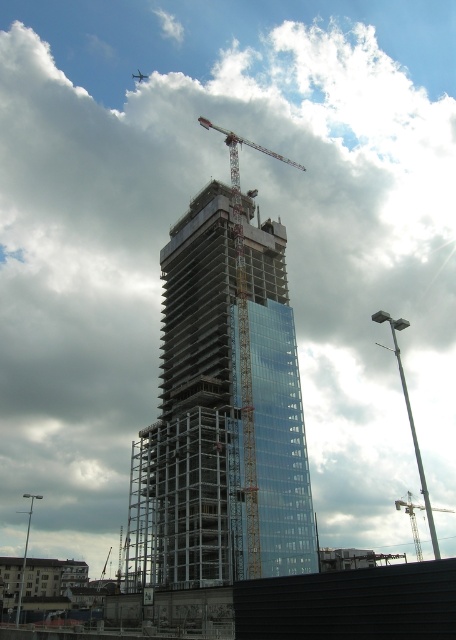
Question: Among these objects, which one is nearest to the camera?

Choices:
 (A) metallic construction crane at center
 (B) transparent glass tower at center

Answer: (B)

Question: Observing the image, what is the correct spatial positioning of transparent glass tower at center in reference to metallic silver crane at center?

Choices:
 (A) right
 (B) left

Answer: (B)

Question: Which object is farther from the camera taking this photo?

Choices:
 (A) metallic construction crane at center
 (B) metallic silver crane at center
 (C) transparent glass tower at center

Answer: (B)

Question: Is metallic construction crane at center positioned in front of metallic silver crane at center?

Choices:
 (A) yes
 (B) no

Answer: (A)

Question: Can you confirm if metallic construction crane at center is wider than metallic silver crane at center?

Choices:
 (A) no
 (B) yes

Answer: (A)

Question: Based on their relative distances, which object is nearer to the transparent glass tower at center?

Choices:
 (A) metallic silver crane at center
 (B) metallic construction crane at center

Answer: (B)